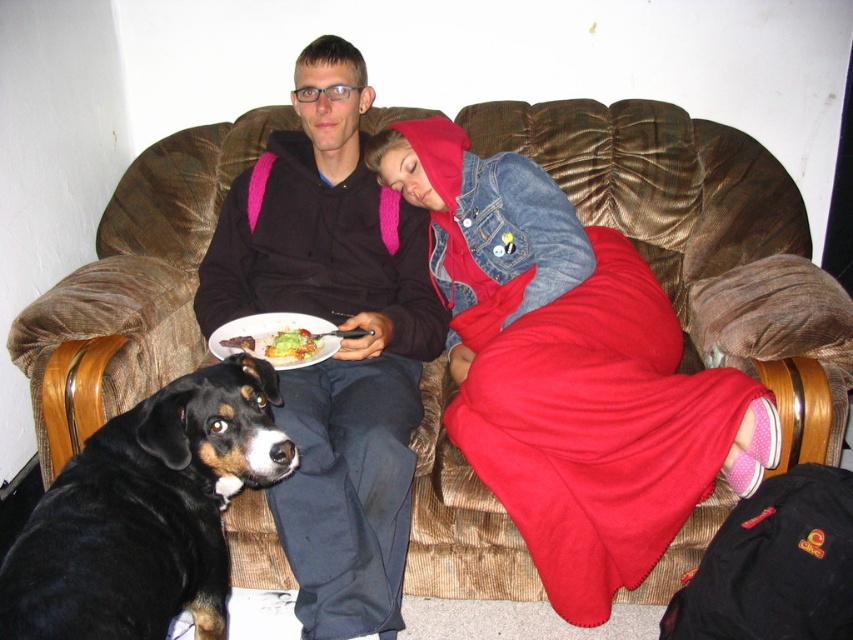
Question: Is black fur dog at lower left smaller than yellowish matte bread at center?

Choices:
 (A) no
 (B) yes

Answer: (A)

Question: Can you confirm if denim jacket at upper right is bigger than black fur dog at lower left?

Choices:
 (A) yes
 (B) no

Answer: (A)

Question: Can you confirm if black fur dog at lower left is positioned to the right of yellowish matte bread at center?

Choices:
 (A) no
 (B) yes

Answer: (A)

Question: Which object is the farthest from the matte black hoodie at center?

Choices:
 (A) denim jacket at upper right
 (B) yellowish matte bread at center

Answer: (B)

Question: Among these objects, which one is nearest to the camera?

Choices:
 (A) yellowish matte bread at center
 (B) matte black hoodie at center

Answer: (B)

Question: Among these points, which one is nearest to the camera?

Choices:
 (A) (279, 346)
 (B) (384, 202)
 (C) (206, 557)
 (D) (547, 561)

Answer: (C)